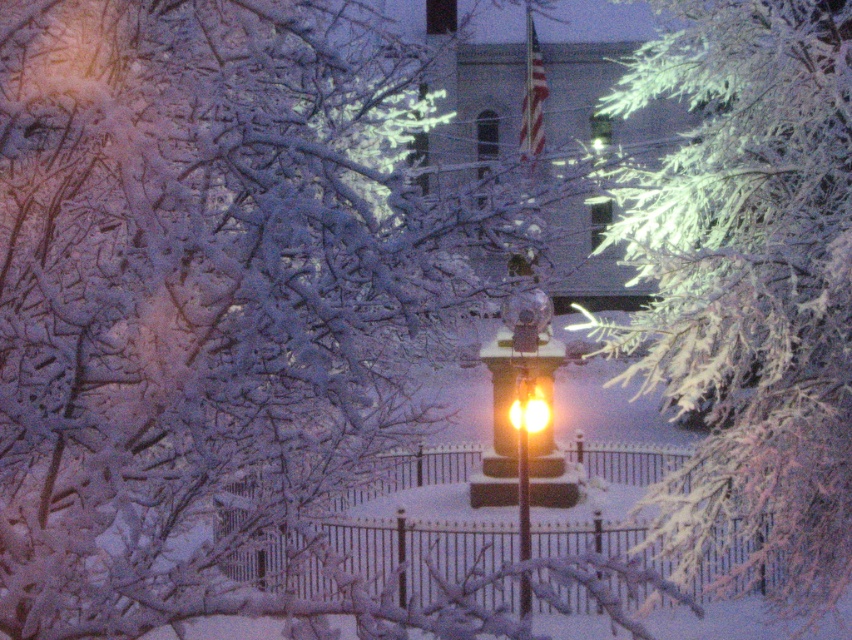
Does matte black street light at center have a smaller size compared to yellow glass streetlight at center?

Actually, matte black street light at center might be larger than yellow glass streetlight at center.

Which is above, matte black street light at center or yellow glass streetlight at center?

yellow glass streetlight at center is higher up.

What do you see at coordinates (522, 397) in the screenshot? I see `matte black street light at center` at bounding box center [522, 397].

This screenshot has height=640, width=852. I want to click on matte black street light at center, so click(522, 397).

Which of these two, icy white branches at upper right or matte glass street light at center, stands shorter?

matte glass street light at center

You are a GUI agent. You are given a task and a screenshot of the screen. Output one action in this format:
    pyautogui.click(x=<x>, y=<y>)
    Task: Click on the icy white branches at upper right
    
    Given the screenshot: What is the action you would take?
    [751, 282]

Measure the distance between point [697,237] and camera.

The distance of point [697,237] from camera is 14.67 meters.

At what (x,y) coordinates should I click in order to perform the action: click on icy white branches at upper right. Please return your answer as a coordinate pair (x, y). Looking at the image, I should click on (751, 282).

Which is in front, point (756, 456) or point (533, 412)?

Point (756, 456) is more forward.

Which of these two, icy white branches at upper right or yellow glass streetlight at center, stands taller?

icy white branches at upper right

Does point (770, 492) come closer to viewer compared to point (550, 412)?

Yes, it is.

You are a GUI agent. You are given a task and a screenshot of the screen. Output one action in this format:
    pyautogui.click(x=<x>, y=<y>)
    Task: Click on the icy white branches at upper right
    Image resolution: width=852 pixels, height=640 pixels.
    Given the screenshot: What is the action you would take?
    pyautogui.click(x=751, y=282)